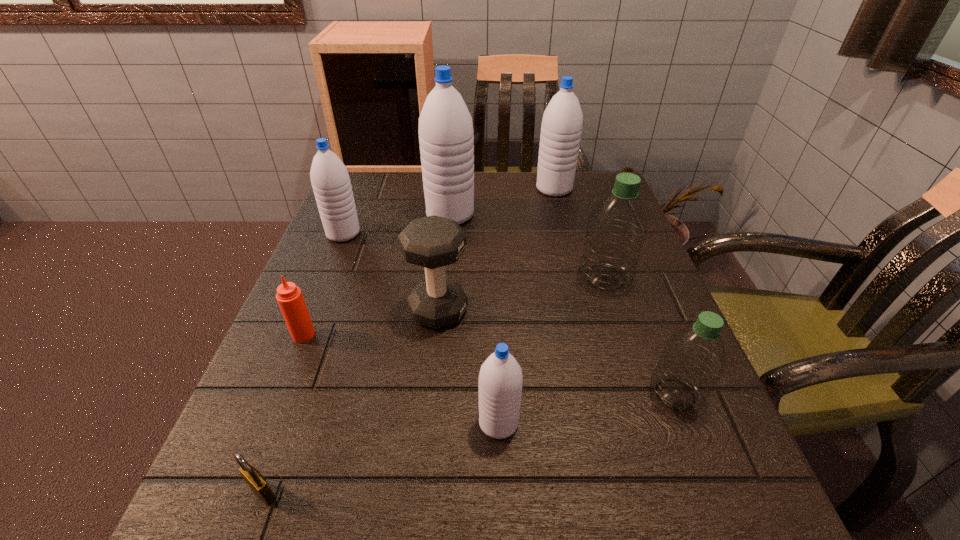
In the image, there is a desktop. In order to click on vacant space at the far edge in this screenshot , I will do `click(509, 181)`.

At what (x,y) coordinates should I click in order to perform the action: click on vacant area at the near edge. Please return your answer as a coordinate pair (x, y). Looking at the image, I should click on (636, 539).

Identify the location of vacant space at the left edge. The width and height of the screenshot is (960, 540). 328,370.

Identify the location of vacant space at the far right corner of the desktop. Image resolution: width=960 pixels, height=540 pixels. (585, 199).

In the image, there is a desktop. At what (x,y) coordinates should I click in order to perform the action: click on vacant area at the near right corner. Please return your answer as a coordinate pair (x, y). This screenshot has height=540, width=960. Looking at the image, I should click on (697, 497).

The image size is (960, 540). I want to click on free space between the third blue water bottle from left to right and the fifth water bottle from right to left, so coord(474,319).

This screenshot has width=960, height=540. I want to click on vacant area between the tallest object and the smaller green water bottle, so click(x=563, y=305).

Where is `free space between the nearest object and the second blue water bottle from left to right`? free space between the nearest object and the second blue water bottle from left to right is located at coordinates (357, 354).

In order to click on vacant space in between the rightmost blue water bottle and the nearest object in this screenshot , I will do `click(409, 341)`.

At what (x,y) coordinates should I click in order to perform the action: click on free space between the nearer green water bottle and the fourth object from right to left. Please return your answer as a coordinate pair (x, y). Looking at the image, I should click on (587, 409).